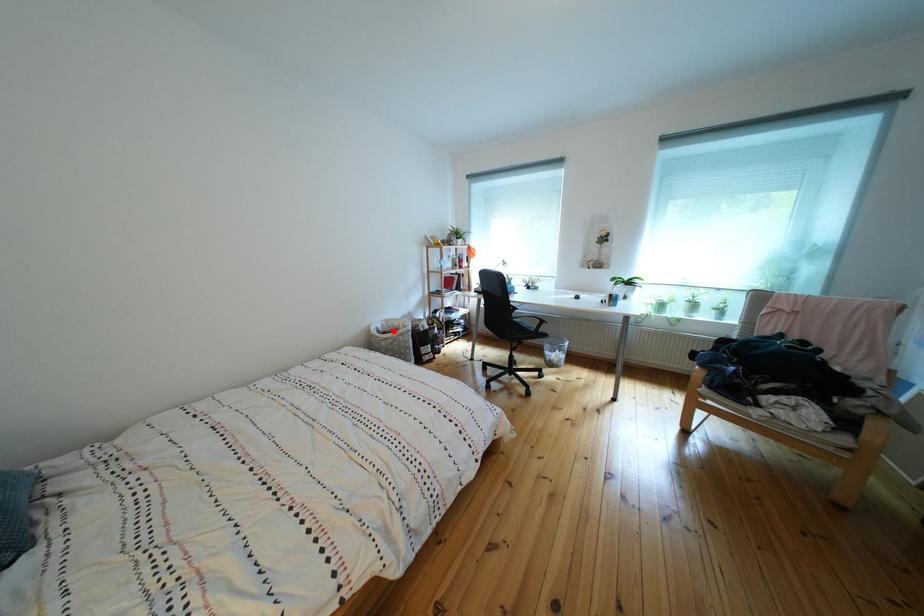
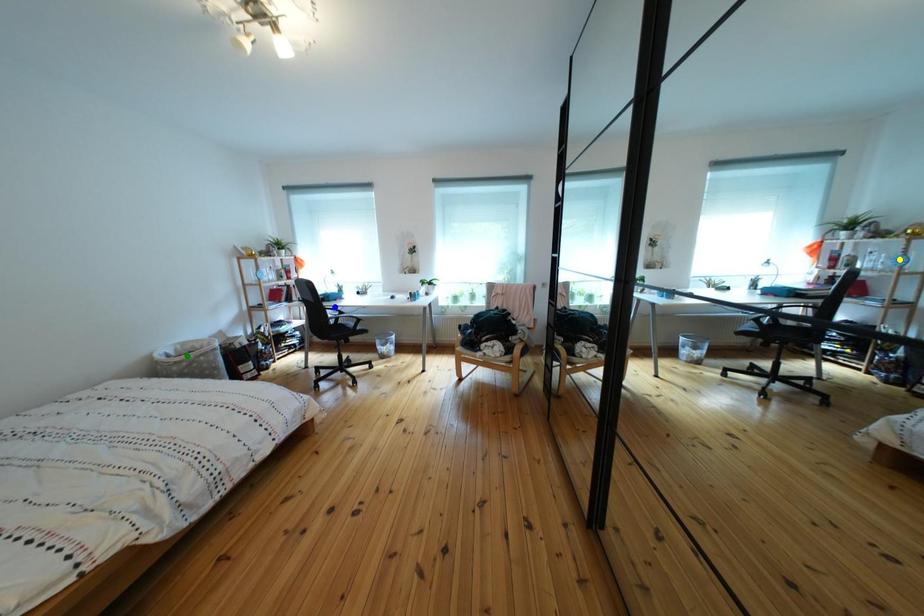
Question: I am providing you with two images of the same scene from different viewpoints. A red point is marked on the first image. You are given multiple points on the second image. Which point in image 2 is actually the same real-world point as the red point in image 1?

Choices:
 (A) blue point
 (B) green point
 (C) yellow point

Answer: (B)